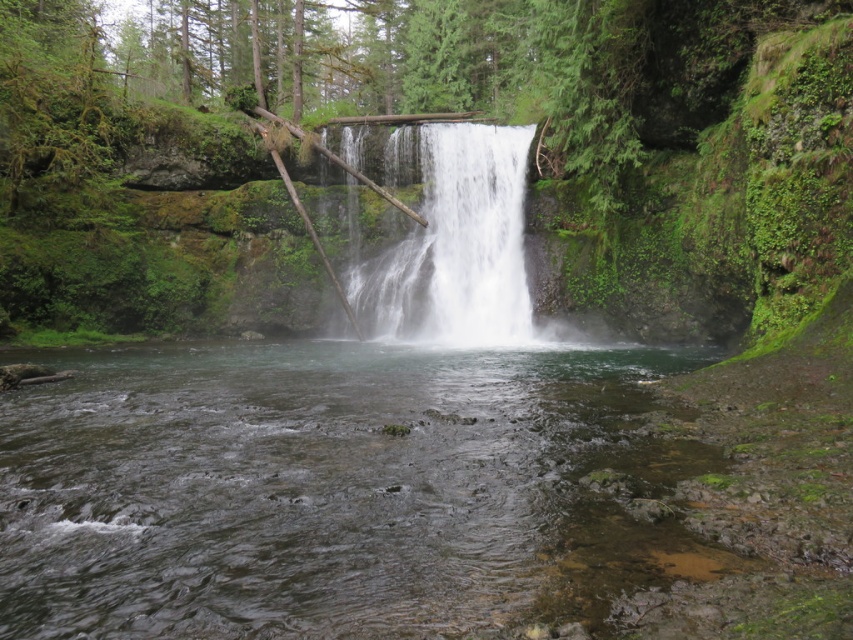
You are a photographer planning to capture the waterfall scene. You notice two distinct water areas at the center of the image. Which one is smaller in size between the clear water at center and the white frothy water at center?

The clear water at center is smaller than the white frothy water at center according to the description.

You are a hiker who wants to collect water from the waterfall. Where exactly is the clear water at center located in the scene?

The clear water at center is located at point 0.764 on the x axis and 0.374 on the y axis.

You are a photographer planning to capture the waterfall. You notice two types of water in the scene. Which one, the clear water at center or the white frothy water at center, is lower in height?

The clear water at center is shorter than the white frothy water at center, so the clear water at center is lower in height.